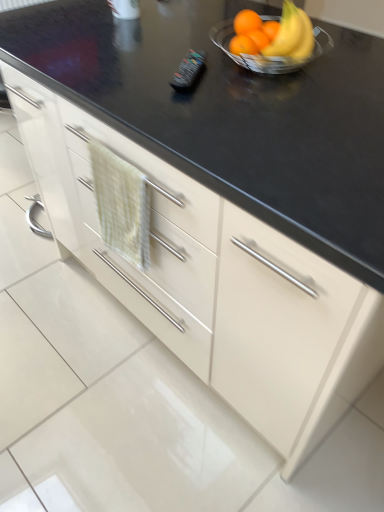
I want to click on vacant area that is in front of clear glass bowl at upper right, so click(279, 99).